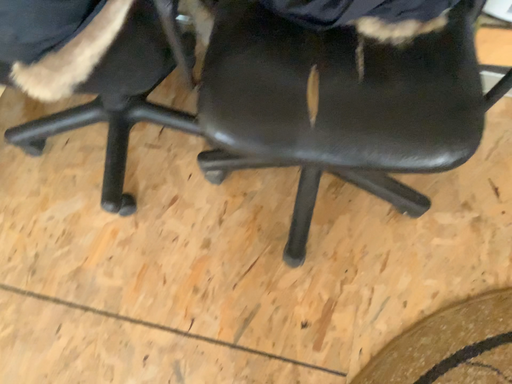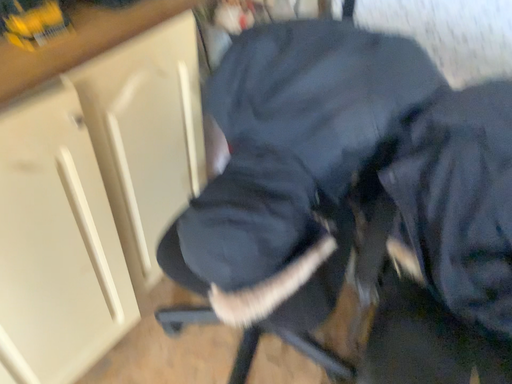
Question: Which way did the camera rotate in the video?

Choices:
 (A) rotated right
 (B) rotated left

Answer: (B)